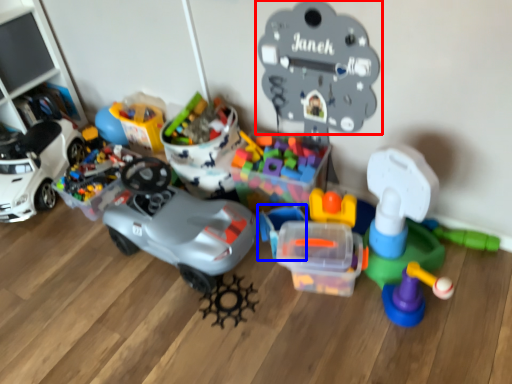
Question: Among these objects, which one is farthest to the camera, toy (highlighted by a red box) or toy (highlighted by a blue box)?

Choices:
 (A) toy
 (B) toy

Answer: (B)